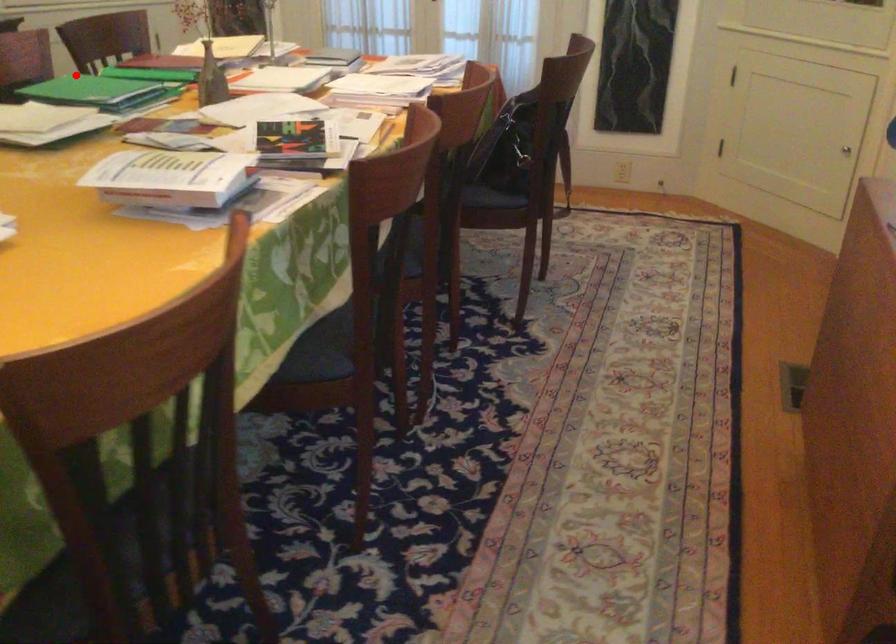
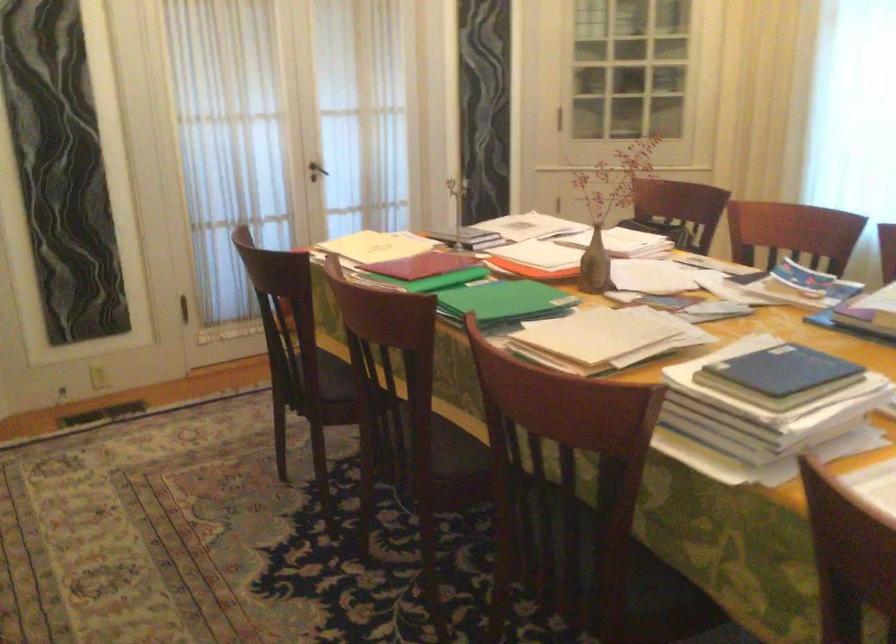
Where in the second image is the point corresponding to the highlighted location from the first image?

(504, 301)